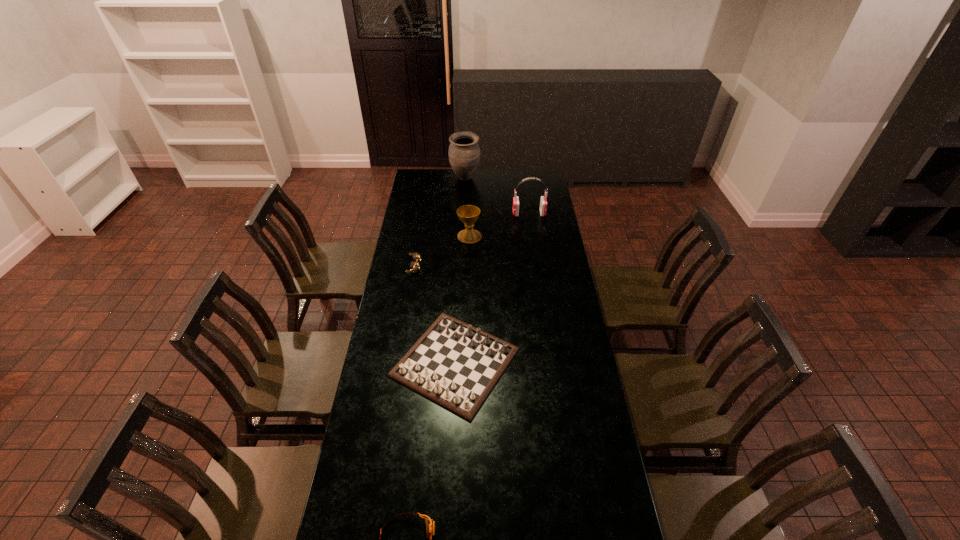
In the image, there is a desktop. Identify the location of vacant region at the far edge. (440, 175).

Where is `free space at the left edge`? The height and width of the screenshot is (540, 960). free space at the left edge is located at coordinates (408, 401).

I want to click on vacant area at the right edge, so click(x=579, y=410).

At what (x,y) coordinates should I click in order to perform the action: click on vacant space at the far right corner of the desktop. Please return your answer as a coordinate pair (x, y). This screenshot has height=540, width=960. Looking at the image, I should click on (528, 172).

The height and width of the screenshot is (540, 960). I want to click on vacant area between the second nearest object and the fourth farthest object, so click(435, 314).

The width and height of the screenshot is (960, 540). Identify the location of vacant area that lies between the urn and the rightmost object. (497, 196).

This screenshot has height=540, width=960. Find the location of `free area in between the second farthest object and the chessboard`. free area in between the second farthest object and the chessboard is located at coordinates (492, 288).

Locate an element on the screen. The width and height of the screenshot is (960, 540). free area in between the rightmost object and the third tallest object is located at coordinates (499, 225).

Where is `free spot between the farther goggles and the third tallest object`? This screenshot has height=540, width=960. free spot between the farther goggles and the third tallest object is located at coordinates (442, 251).

At what (x,y) coordinates should I click in order to perform the action: click on blank region between the third nearest object and the urn. Please return your answer as a coordinate pair (x, y). Looking at the image, I should click on (440, 222).